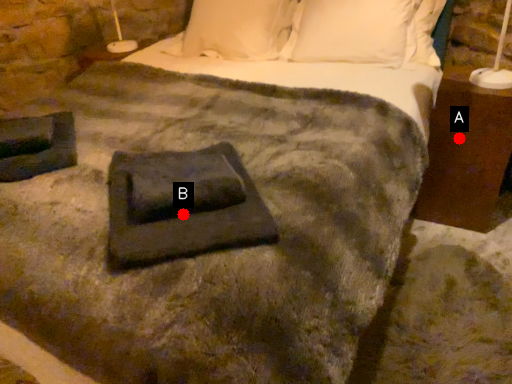
Question: Two points are circled on the image, labeled by A and B beside each circle. Which point is closer to the camera?

Choices:
 (A) A is closer
 (B) B is closer

Answer: (B)